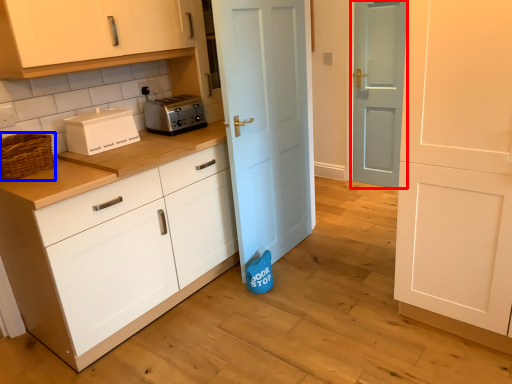
Question: Which point is closer to the camera, door (highlighted by a red box) or basket (highlighted by a blue box)?

Choices:
 (A) door
 (B) basket

Answer: (B)